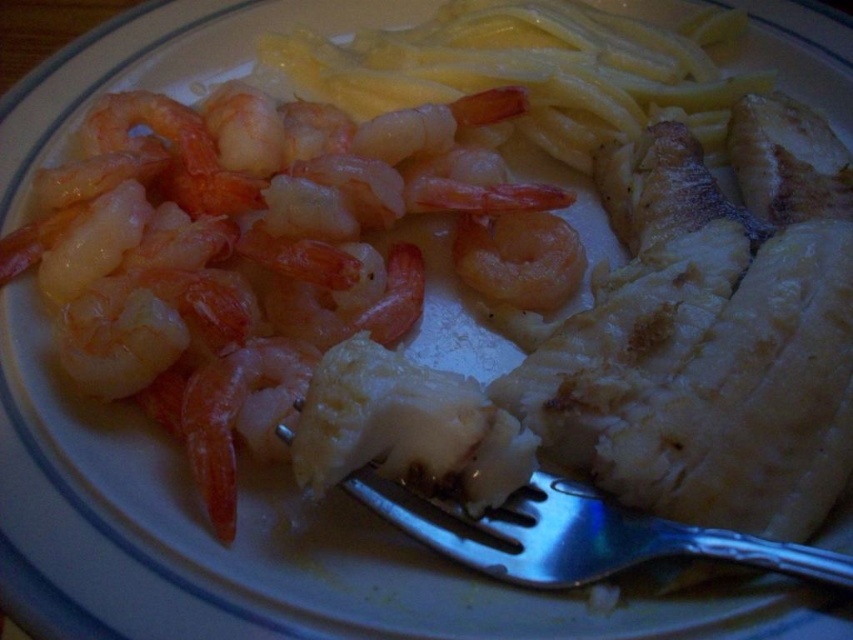
In the scene shown: You are a chef trying to determine the appropriate utensil for serving. Given the pink translucent shrimp at upper left and the silver metallic fork at center, which one is more suitable for serving the grilled fish?

The silver metallic fork at center is more suitable for serving the grilled fish because the pink translucent shrimp at upper left is larger in size than the fork, making it less practical for handling the fish.

You are trying to decide whether to use the silver metallic fork at center to pick up the pink translucent shrimp at upper left. Based on their sizes, is the shrimp wider than the fork?

The pink translucent shrimp at upper left might be wider than silver metallic fork at center, so there is a possibility that the shrimp is wider than the fork.